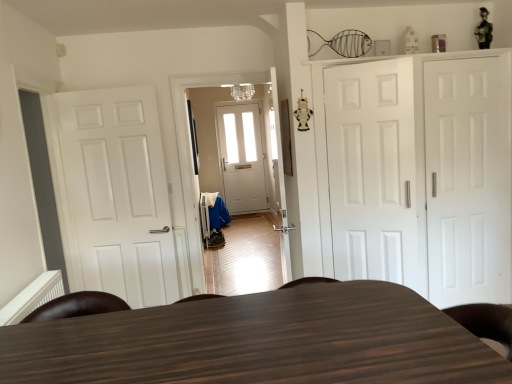
Question: Is point (425, 200) positioned closer to the camera than point (495, 107)?

Choices:
 (A) closer
 (B) farther

Answer: (B)

Question: In terms of size, does white matte cabinet at right appear bigger or smaller than white matte door at right, the 1th door viewed from the right?

Choices:
 (A) small
 (B) big

Answer: (B)

Question: Which object is positioned closest to the dark wood table at center?

Choices:
 (A) white matte door at center, arranged as the 2th door when viewed from the right
 (B) white matte door at right, arranged as the 3th door when viewed from the left
 (C) white matte door at left, which is counted as the 3th door, starting from the right
 (D) white matte cabinet at right

Answer: (A)

Question: Estimate the real-world distances between objects in this image. Which object is closer to the white matte cabinet at right?

Choices:
 (A) dark wood table at center
 (B) white matte door at center, arranged as the 2th door when viewed from the right
 (C) white matte door at left, acting as the first door starting from the left
 (D) white matte door at right, arranged as the 3th door when viewed from the left

Answer: (B)